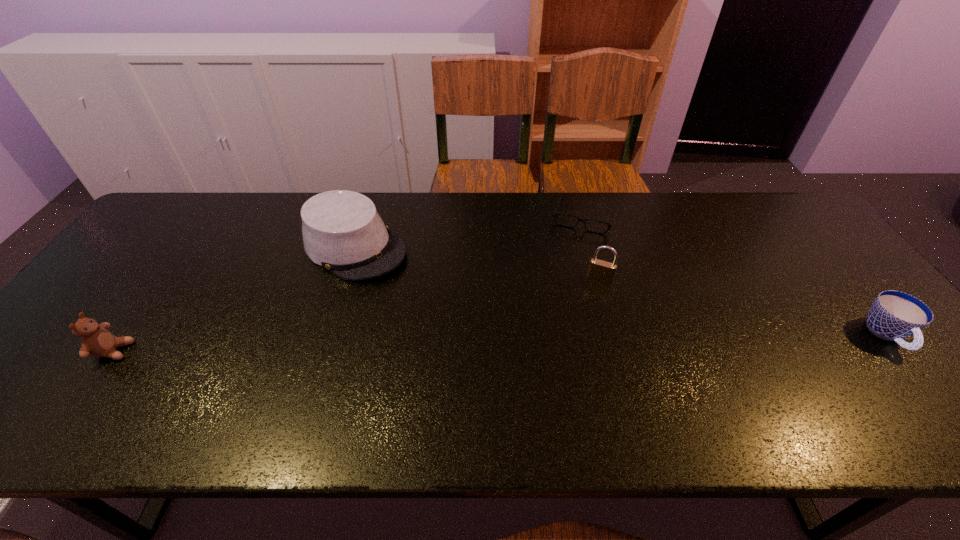
Find the location of a particular element. teddy bear is located at coordinates point(96,341).

The height and width of the screenshot is (540, 960). Identify the location of the second shortest object. (894, 315).

I want to click on the rightmost object, so click(x=894, y=315).

Locate an element on the screen. padlock is located at coordinates (599, 270).

This screenshot has width=960, height=540. Identify the location of hat. (342, 231).

The width and height of the screenshot is (960, 540). I want to click on spectacles, so click(555, 214).

Locate an element on the screen. Image resolution: width=960 pixels, height=540 pixels. free space located on the front-facing side of the teddy bear is located at coordinates (156, 351).

Locate an element on the screen. The width and height of the screenshot is (960, 540). blank area located 0.050m on the side of the fourth tallest object with the handle is located at coordinates click(x=923, y=378).

Identify the location of vacant space located 0.260m on the front-facing side of the padlock. (571, 357).

At what (x,y) coordinates should I click in order to perform the action: click on vacant space located 0.260m on the front-facing side of the padlock. Please return your answer as a coordinate pair (x, y). The height and width of the screenshot is (540, 960). Looking at the image, I should click on (571, 357).